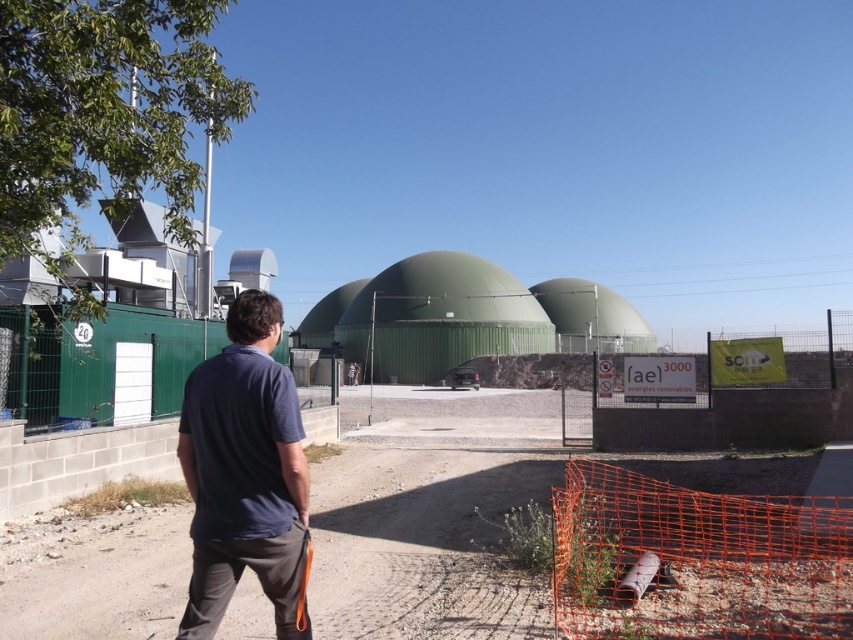
Which is below, dirt track at lower center or dark blue cotton shirt at center?

dirt track at lower center is lower down.

From the picture: Does dirt track at lower center lie in front of dark blue cotton shirt at center?

That is False.

Identify the location of dirt track at lower center. The height and width of the screenshot is (640, 853). (422, 544).